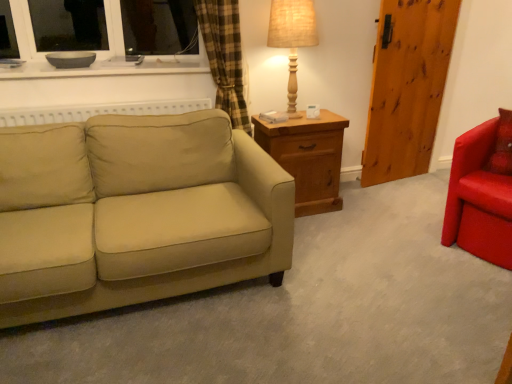
The height and width of the screenshot is (384, 512). I want to click on free spot in front of wooden barn door at right, so click(x=409, y=190).